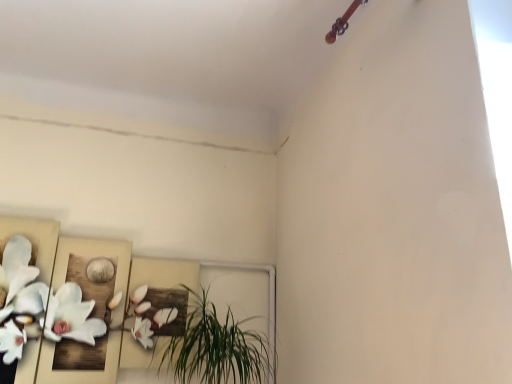
Image resolution: width=512 pixels, height=384 pixels. In order to click on green leafy plant at lower left in this screenshot , I will do `click(221, 346)`.

This screenshot has width=512, height=384. What do you see at coordinates (221, 346) in the screenshot?
I see `green leafy plant at lower left` at bounding box center [221, 346].

What is the approximate width of green leafy plant at lower left?

It is 23.75 inches.

The width and height of the screenshot is (512, 384). Find the location of `green leafy plant at lower left`. green leafy plant at lower left is located at coordinates (221, 346).